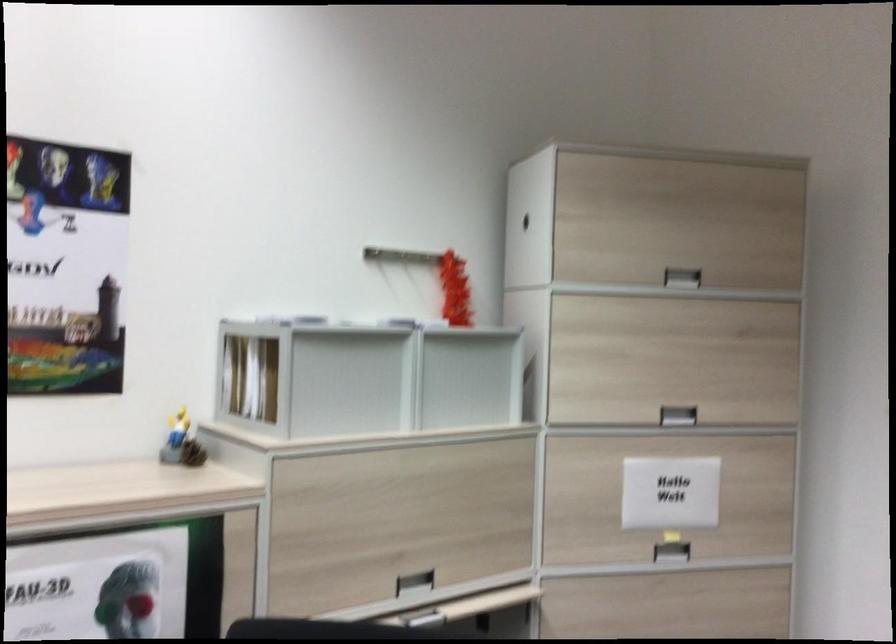
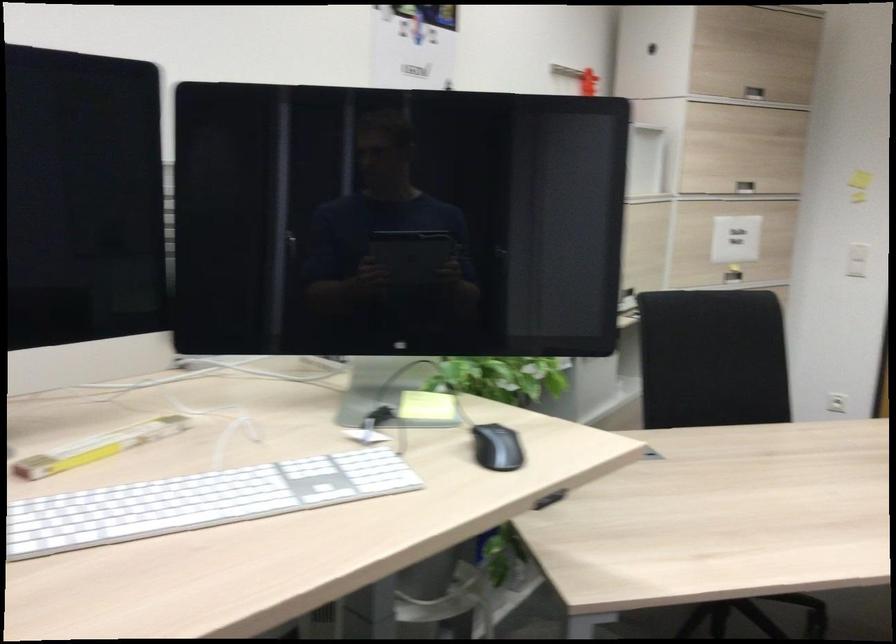
The point at (645,550) is marked in the first image. Where is the corresponding point in the second image?

(733, 275)